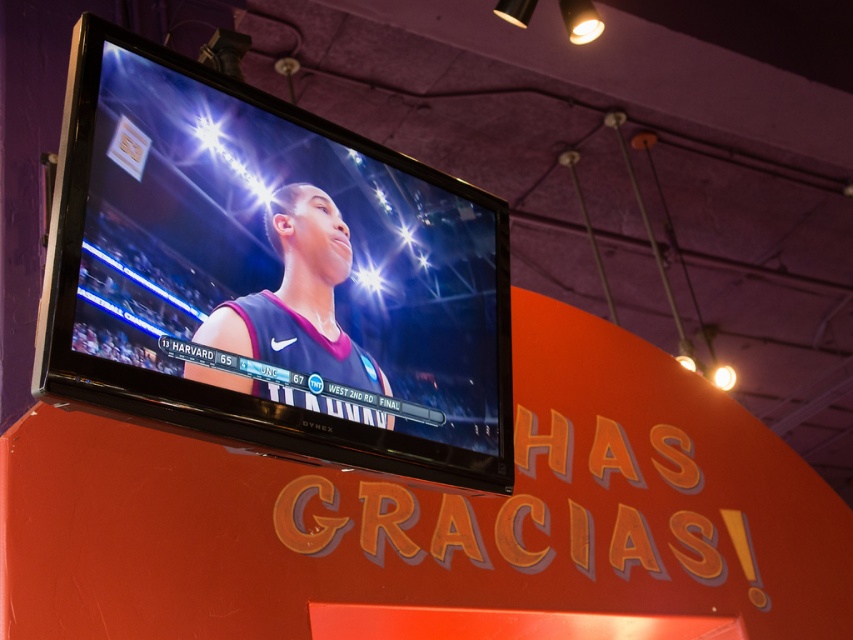
You are standing in a room and want to place a small plant between the matte black tv at upper center and the matte black jersey at center. Can you do this without the plant being directly in front of either object?

The matte black tv at upper center is closer to the viewer than the matte black jersey at center. Therefore, placing the plant between them would require positioning it closer to the tv, but it might still be in front of the jersey. Since the tv is closer, the plant could be placed between them without being directly in front of either object if positioned appropriately.

You are a photographer trying to capture a clear shot of the matte black tv at upper center and the matte black jersey at center. Since both are matte black, you need to adjust your camera settings to account for their reflective properties. Which object should you focus on first to ensure proper exposure, considering their positions?

The matte black tv at upper center is located above the matte black jersey at center, so you should focus on the matte black tv at upper center first to ensure proper exposure because it is higher and might receive different lighting compared to the jersey below.

You are setting up a display and need to place a decorative basketball between the matte black tv at upper center and the matte black jersey at center. Since the basketball must be placed closer to the larger object, where should you position it?

The matte black tv at upper center is larger than the matte black jersey at center, so the basketball should be placed closer to the matte black tv at upper center.